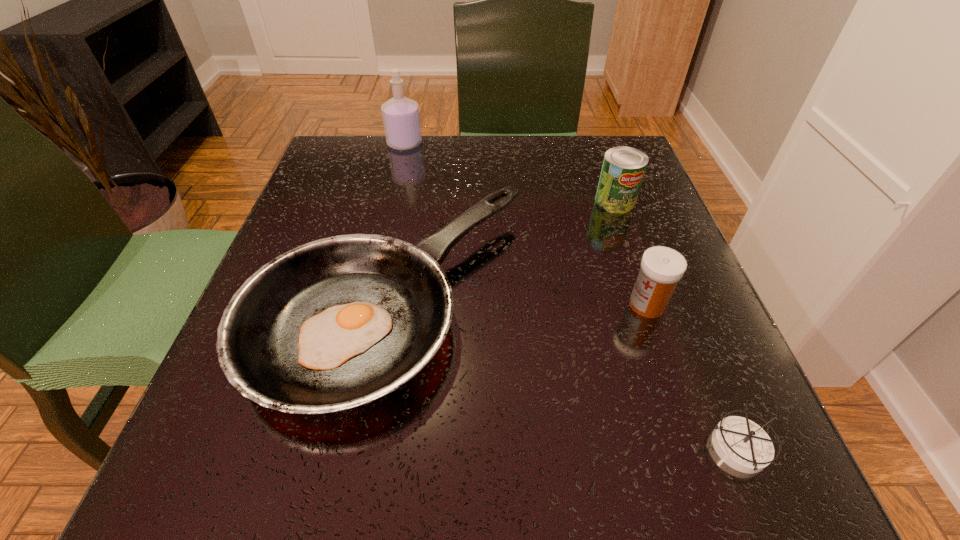
At what (x,y) coordinates should I click in order to perform the action: click on perfume. Please return your answer as a coordinate pair (x, y). Looking at the image, I should click on (401, 119).

Image resolution: width=960 pixels, height=540 pixels. I want to click on the tallest object, so click(x=401, y=119).

Locate an element on the screen. This screenshot has width=960, height=540. can is located at coordinates (623, 169).

Locate an element on the screen. Image resolution: width=960 pixels, height=540 pixels. medicine is located at coordinates (661, 268).

Find the location of a particular element. The width and height of the screenshot is (960, 540). frying pan is located at coordinates (336, 323).

The height and width of the screenshot is (540, 960). I want to click on compass, so click(742, 444).

This screenshot has height=540, width=960. I want to click on free space located on the front of the farthest object, so click(x=377, y=261).

The width and height of the screenshot is (960, 540). I want to click on free location located 0.150m on the back of the can, so click(598, 153).

Where is `vacant space located on the front of the medicine`? The height and width of the screenshot is (540, 960). vacant space located on the front of the medicine is located at coordinates (669, 369).

Find the location of a particular element. free space located 0.250m on the right of the fourth tallest object is located at coordinates (677, 299).